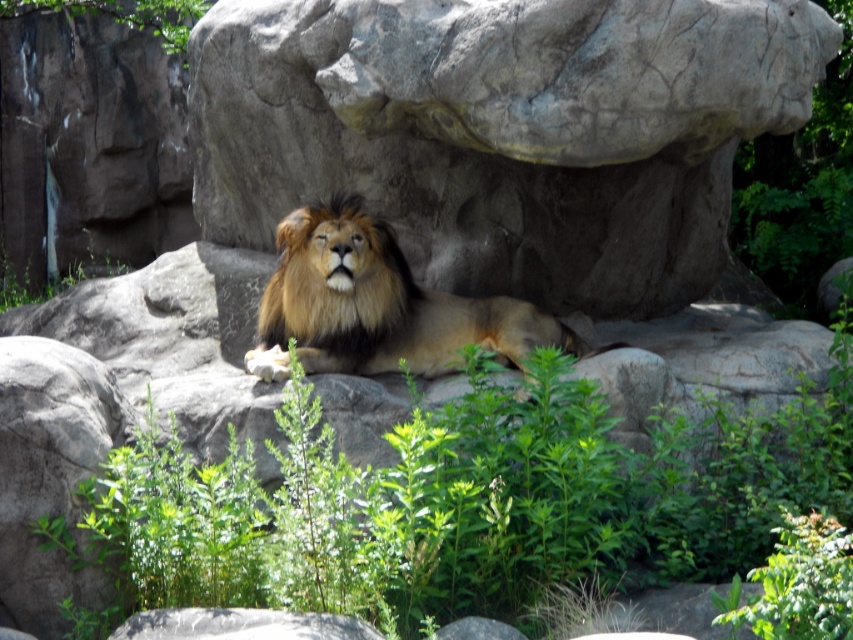
Is gray rough rock at center below green leafy plant at center?

Actually, gray rough rock at center is above green leafy plant at center.

Is the position of gray rough rock at center less distant than that of green leafy plant at center?

No, gray rough rock at center is further to the viewer.

In the scene shown: Who is more distant from viewer, (x=700, y=221) or (x=193, y=592)?

Positioned behind is point (x=700, y=221).

The width and height of the screenshot is (853, 640). In order to click on gray rough rock at center in this screenshot , I will do `click(503, 131)`.

What are the coordinates of `green leafy plant at center` in the screenshot? It's located at (461, 502).

Is green leafy plant at center above golden fur lion at center?

Actually, green leafy plant at center is below golden fur lion at center.

Find the location of `green leafy plant at center`. green leafy plant at center is located at coordinates (461, 502).

Does gray rough rock at center appear under golden fur lion at center?

No, gray rough rock at center is not below golden fur lion at center.

Is gray rough rock at center smaller than golden fur lion at center?

Actually, gray rough rock at center might be larger than golden fur lion at center.

Image resolution: width=853 pixels, height=640 pixels. What are the coordinates of `gray rough rock at center` in the screenshot? It's located at (503, 131).